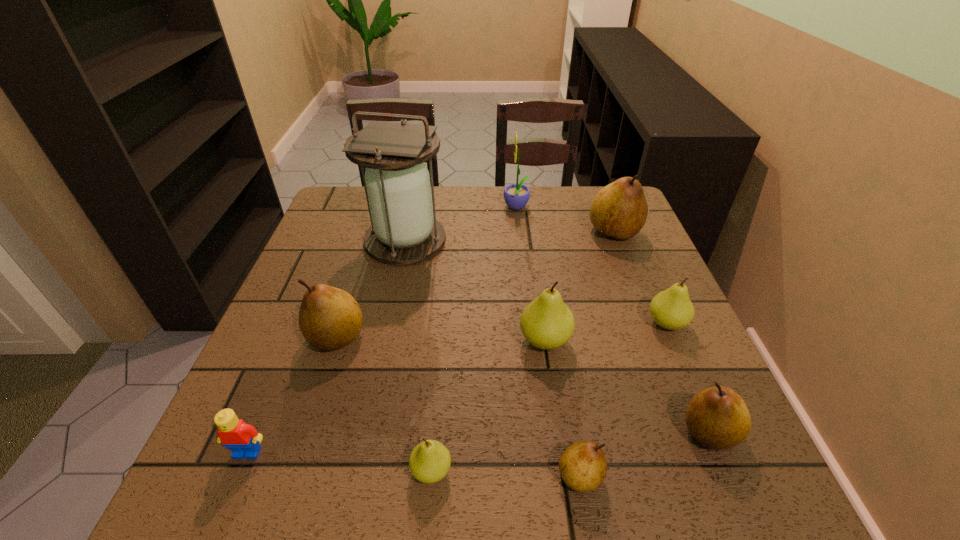
Identify the location of Lego located at the left edge. This screenshot has height=540, width=960. (243, 439).

Find the location of `object that is positioned at the far left corner`. object that is positioned at the far left corner is located at coordinates (397, 184).

At what (x,y) coordinates should I click in order to perform the action: click on object that is positioned at the near left corner. Please return your answer as a coordinate pair (x, y). The height and width of the screenshot is (540, 960). Looking at the image, I should click on (243, 439).

The image size is (960, 540). In order to click on object located in the far right corner section of the desktop in this screenshot , I will do pyautogui.click(x=619, y=210).

Identify the location of object at the near right corner. The height and width of the screenshot is (540, 960). (718, 418).

I want to click on vacant space at the far edge of the desktop, so click(494, 217).

The width and height of the screenshot is (960, 540). I want to click on free point at the near edge, so click(563, 487).

Where is `vacant point at the left edge`? vacant point at the left edge is located at coordinates (282, 373).

Where is `free space at the right edge of the desktop`? The image size is (960, 540). free space at the right edge of the desktop is located at coordinates pos(644,302).

In the image, there is a desktop. Identify the location of vacant space at the far left corner. (365, 204).